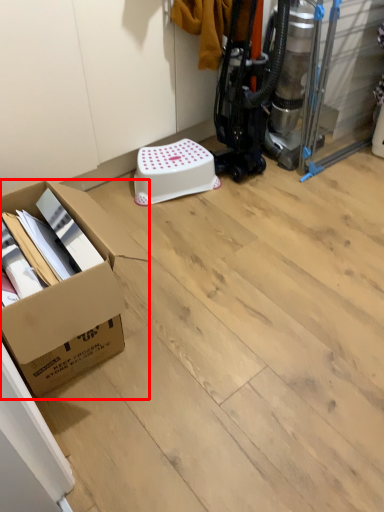
Question: Where is box (annotated by the red box) located in relation to stool in the image?

Choices:
 (A) right
 (B) left

Answer: (B)